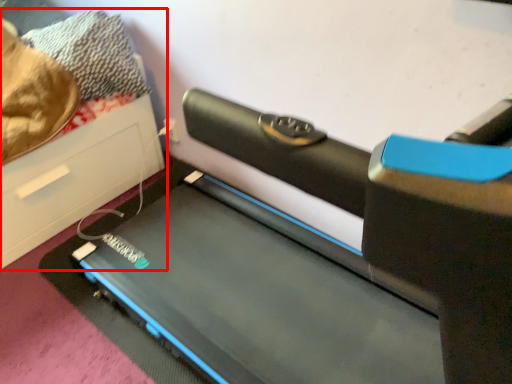
Question: Observing the image, what is the correct spatial positioning of furniture (annotated by the red box) in reference to treadmill?

Choices:
 (A) right
 (B) left

Answer: (B)